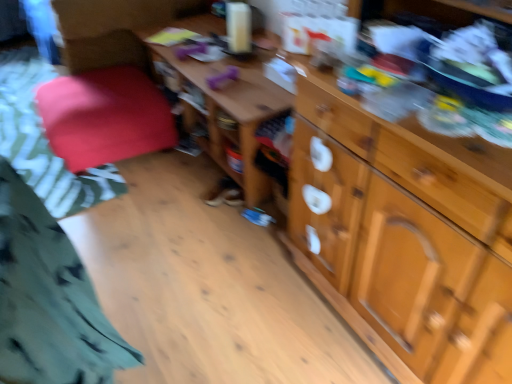
Question: Does wooden drawer at right have a greater height compared to velvet red cushion at left?

Choices:
 (A) no
 (B) yes

Answer: (A)

Question: Is wooden drawer at right outside velvet red cushion at left?

Choices:
 (A) no
 (B) yes

Answer: (B)

Question: From a real-world perspective, is wooden drawer at right under velvet red cushion at left?

Choices:
 (A) no
 (B) yes

Answer: (A)

Question: Is the surface of wooden drawer at right in direct contact with velvet red cushion at left?

Choices:
 (A) yes
 (B) no

Answer: (B)

Question: Does wooden drawer at right lie behind velvet red cushion at left?

Choices:
 (A) no
 (B) yes

Answer: (A)

Question: Considering the relative sizes of wooden drawer at right and velvet red cushion at left in the image provided, is wooden drawer at right wider than velvet red cushion at left?

Choices:
 (A) yes
 (B) no

Answer: (B)

Question: From the image's perspective, would you say wooden table at center is positioned over green cotton shirt at lower left?

Choices:
 (A) yes
 (B) no

Answer: (A)

Question: Does wooden table at center come behind green cotton shirt at lower left?

Choices:
 (A) no
 (B) yes

Answer: (B)

Question: Can you confirm if wooden table at center is positioned to the left of green cotton shirt at lower left?

Choices:
 (A) yes
 (B) no

Answer: (B)

Question: Considering the relative sizes of wooden table at center and green cotton shirt at lower left in the image provided, is wooden table at center thinner than green cotton shirt at lower left?

Choices:
 (A) yes
 (B) no

Answer: (B)

Question: Is wooden table at center positioned in front of green cotton shirt at lower left?

Choices:
 (A) no
 (B) yes

Answer: (A)

Question: Is green cotton shirt at lower left inside wooden table at center?

Choices:
 (A) no
 (B) yes

Answer: (A)

Question: Can you confirm if wooden drawer at right is thinner than velvet red cushion at left?

Choices:
 (A) yes
 (B) no

Answer: (A)